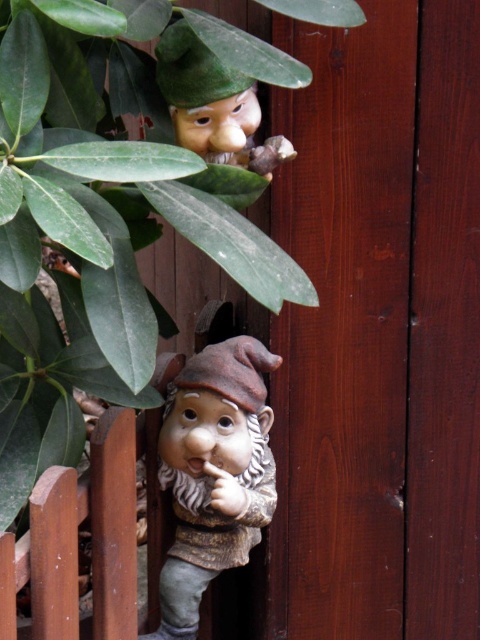
The image size is (480, 640). Describe the element at coordinates (214, 474) in the screenshot. I see `matte brown statue at center` at that location.

Where is `matte brown statue at center`? matte brown statue at center is located at coordinates pos(214,474).

Is point (219, 420) positioned behind point (192, 61)?

Yes, point (219, 420) is behind point (192, 61).

I want to click on matte brown statue at center, so click(x=214, y=474).